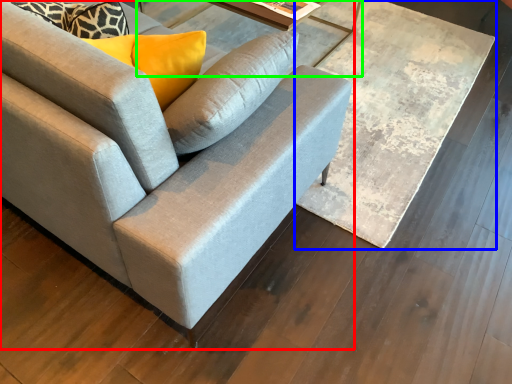
Question: Estimate the real-world distances between objects in this image. Which object is closer to studio couch (highlighted by a red box), table (highlighted by a blue box) or round table (highlighted by a green box)?

Choices:
 (A) table
 (B) round table

Answer: (A)